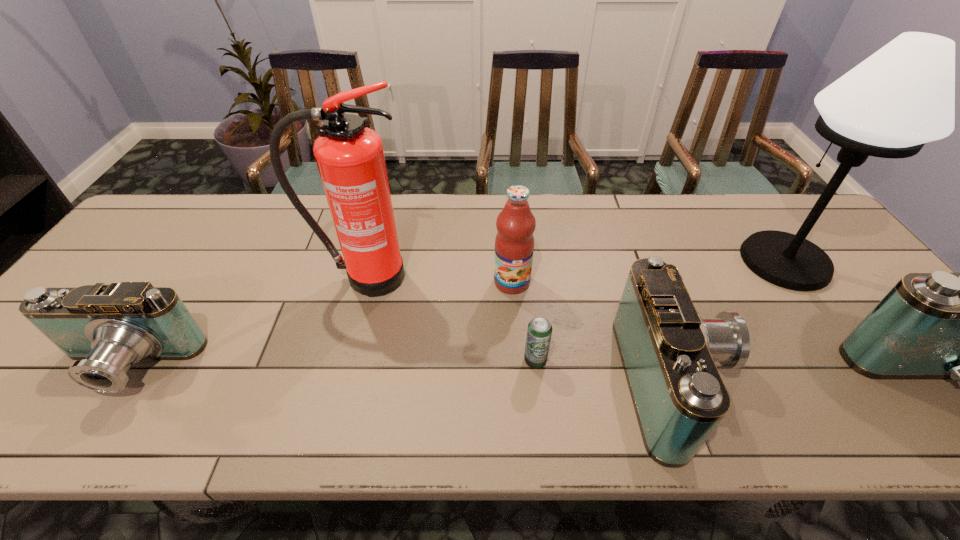
Identify the location of the leftmost camcorder. (107, 328).

Locate an element on the screen. This screenshot has width=960, height=540. the second shortest object is located at coordinates (107, 328).

In order to click on the second shortest camcorder in this screenshot , I will do [668, 352].

Find the location of `the third shortest object`. the third shortest object is located at coordinates (668, 352).

Find the location of a particular element. This screenshot has height=540, width=960. fruit juice is located at coordinates (514, 244).

Identify the location of table lamp. (903, 96).

Identify the location of the sixth object from right to left. The width and height of the screenshot is (960, 540). (350, 158).

In order to click on beer can in this screenshot , I will do `click(539, 331)`.

Find the location of a particular element. This screenshot has width=960, height=540. free region located on the front-facing side of the third shortest object is located at coordinates (892, 381).

Find the location of a particular element. The width and height of the screenshot is (960, 540). vacant space situated on the front label of the fruit juice is located at coordinates (516, 342).